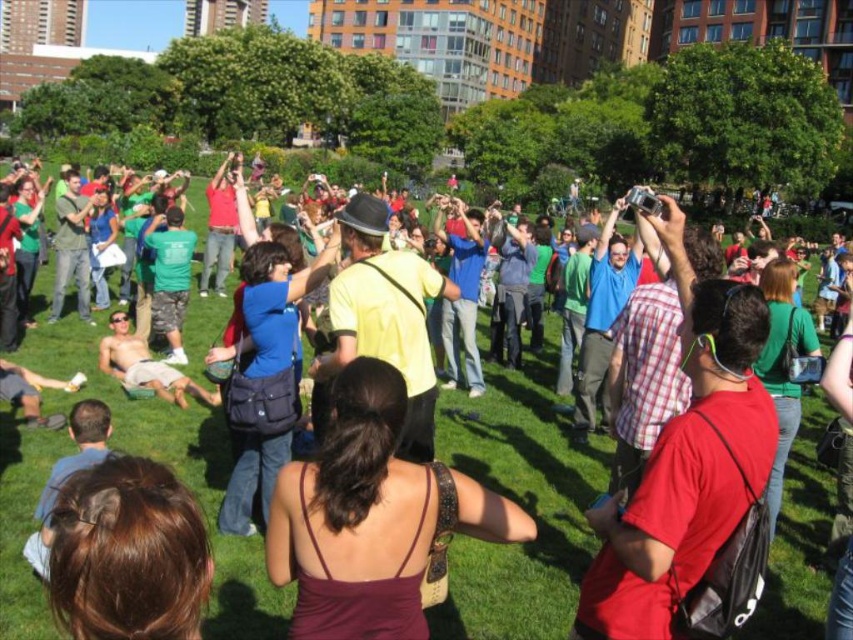
You are a photographer at the park event and need to capture both the maroon fabric dress at center and the red matte shirt at center in a single frame. Which clothing item will appear larger in your photo?

The maroon fabric dress at center will appear larger in the photo because it is bigger than the red matte shirt at center.

You are a photographer trying to capture a clear shot of the tan skin shirtless man at center and the red matte shirt at center. Based on their positions, which one is blocking the other from your view?

The red matte shirt at center is below the tan skin shirtless man at center, so the tan skin shirtless man at center is blocking the view of the red matte shirt at center.